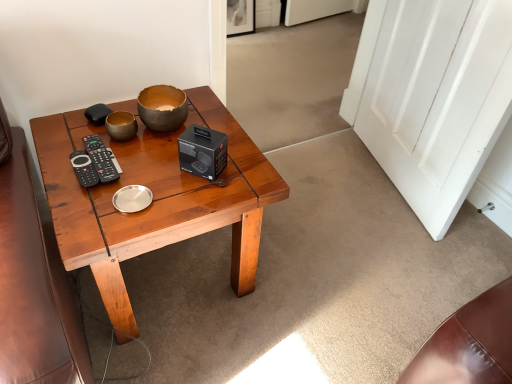
Where is `free space below white glossy door at right (from a real-world perspective)`? The image size is (512, 384). free space below white glossy door at right (from a real-world perspective) is located at coordinates (384, 187).